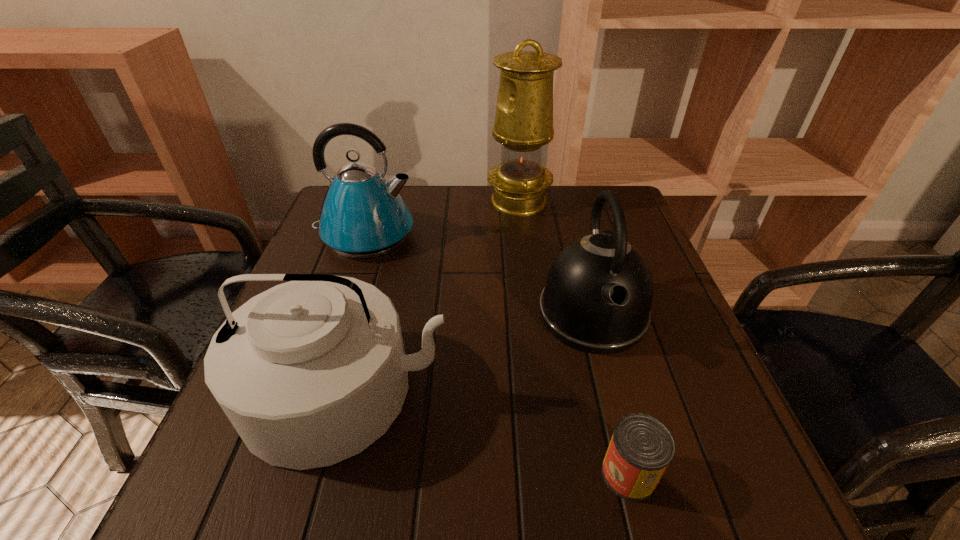
Where is `kettle that is at the near edge`? The height and width of the screenshot is (540, 960). kettle that is at the near edge is located at coordinates (310, 372).

Identify the location of can that is at the near edge. This screenshot has height=540, width=960. (641, 448).

Where is `kettle at the right edge`? The height and width of the screenshot is (540, 960). kettle at the right edge is located at coordinates (599, 290).

At what (x,y) coordinates should I click in order to perform the action: click on can at the right edge. Please return your answer as a coordinate pair (x, y). The image size is (960, 540). Looking at the image, I should click on (641, 448).

I want to click on object at the far left corner, so click(x=363, y=215).

You are a GUI agent. You are given a task and a screenshot of the screen. Output one action in this format:
    pyautogui.click(x=<x>, y=<y>)
    Task: Click on the object that is at the near left corner
    Image resolution: width=960 pixels, height=540 pixels.
    Given the screenshot: What is the action you would take?
    pyautogui.click(x=310, y=372)

I want to click on object located at the near right corner, so click(x=641, y=448).

Find the location of `vacant space at the far edge of the desktop`. vacant space at the far edge of the desktop is located at coordinates (417, 193).

This screenshot has width=960, height=540. What are the coordinates of `vacant space at the near edge of the desktop` in the screenshot? It's located at (503, 489).

The image size is (960, 540). In the image, there is a desktop. In order to click on free space at the left edge in this screenshot , I will do `click(346, 267)`.